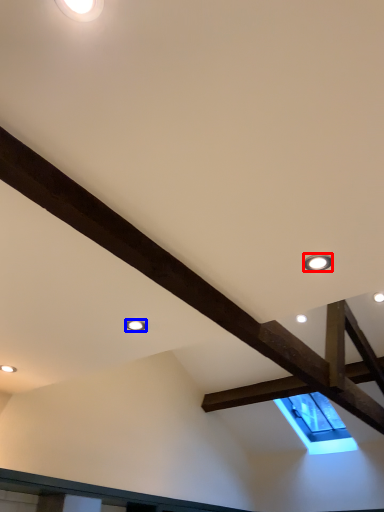
Question: Which object is closer to the camera taking this photo, droplight (highlighted by a red box) or droplight (highlighted by a blue box)?

Choices:
 (A) droplight
 (B) droplight

Answer: (A)